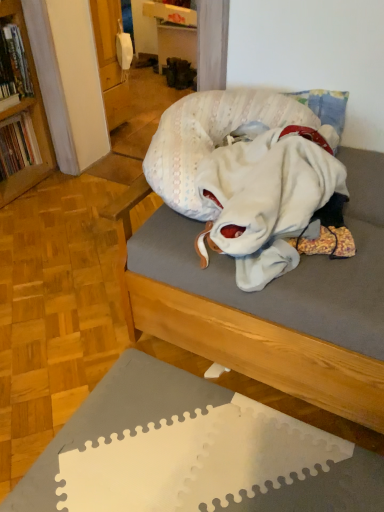
Question: In the image, is white cotton blanket at center on the left side or the right side of wooden studio couch at center?

Choices:
 (A) right
 (B) left

Answer: (B)

Question: From the image's perspective, relative to wooden studio couch at center, is white cotton blanket at center above or below?

Choices:
 (A) above
 (B) below

Answer: (A)

Question: Which object is the closest to the white cotton blanket at center?

Choices:
 (A) white textured pillow at center
 (B) wooden studio couch at center
 (C) hardcover book at left, the 1th book from the bottom
 (D) hardcover book at left, arranged as the second book when ordered from the bottom

Answer: (A)

Question: Considering the real-world distances, which object is farthest from the wooden studio couch at center?

Choices:
 (A) hardcover book at left, which is counted as the 1th book, starting from the top
 (B) white textured pillow at center
 (C) hardcover book at left, marked as the 2th book in a top-to-bottom arrangement
 (D) white cotton blanket at center

Answer: (A)